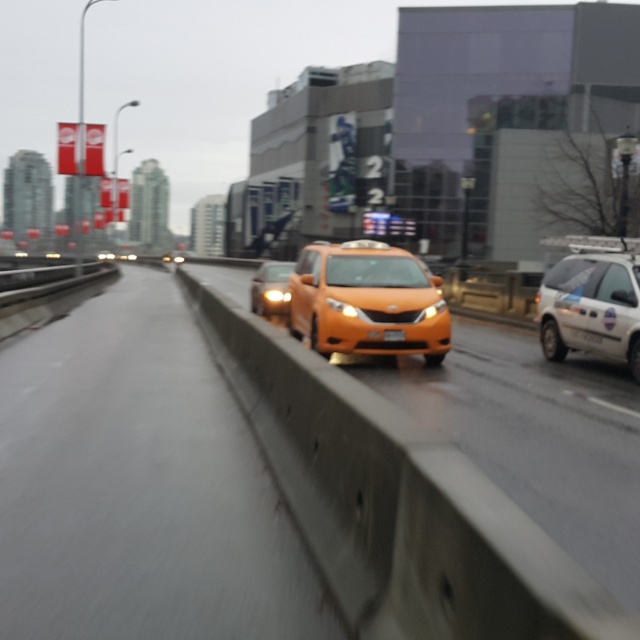
Question: Does white matte van at right have a lesser width compared to yellow plastic license plate at center?

Choices:
 (A) no
 (B) yes

Answer: (A)

Question: Does matte orange taxi at center have a greater width compared to matte black sedan at center?

Choices:
 (A) no
 (B) yes

Answer: (A)

Question: Which object is closer to the camera taking this photo?

Choices:
 (A) yellow plastic license plate at center
 (B) orange glossy taxi at right
 (C) orange matte car at center
 (D) matte orange taxi at center

Answer: (C)

Question: Based on their relative distances, which object is nearer to the orange glossy taxi at right?

Choices:
 (A) matte black sedan at center
 (B) yellow plastic license plate at center
 (C) white matte van at right
 (D) orange matte car at center

Answer: (D)

Question: Which object appears closest to the camera in this image?

Choices:
 (A) white matte van at right
 (B) orange matte car at center
 (C) matte orange taxi at center

Answer: (B)

Question: Does orange glossy taxi at right appear on the right side of matte orange taxi at center?

Choices:
 (A) no
 (B) yes

Answer: (A)